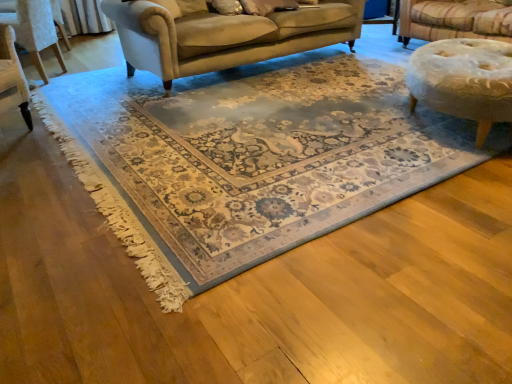
Question: Considering the relative sizes of velvet upholstered chair at upper left and beige wool rug at center in the image provided, is velvet upholstered chair at upper left smaller than beige wool rug at center?

Choices:
 (A) no
 (B) yes

Answer: (B)

Question: Can you confirm if velvet upholstered chair at upper left is thinner than beige wool rug at center?

Choices:
 (A) no
 (B) yes

Answer: (B)

Question: Does velvet upholstered chair at upper left lie in front of beige wool rug at center?

Choices:
 (A) no
 (B) yes

Answer: (A)

Question: Is velvet upholstered chair at upper left facing away from beige wool rug at center?

Choices:
 (A) yes
 (B) no

Answer: (A)

Question: Is beige wool rug at center completely or partially inside velvet upholstered chair at upper left?

Choices:
 (A) yes
 (B) no

Answer: (B)

Question: Can you confirm if velvet upholstered chair at upper left is taller than beige wool rug at center?

Choices:
 (A) no
 (B) yes

Answer: (B)

Question: Is beige wool rug at center aimed at velvet upholstered chair at upper left?

Choices:
 (A) yes
 (B) no

Answer: (B)

Question: Is the surface of beige wool rug at center in direct contact with velvet upholstered chair at upper left?

Choices:
 (A) yes
 (B) no

Answer: (B)

Question: From the image's perspective, is beige wool rug at center beneath velvet upholstered chair at upper left?

Choices:
 (A) no
 (B) yes

Answer: (B)

Question: Is beige wool rug at center looking in the opposite direction of velvet upholstered chair at upper left?

Choices:
 (A) yes
 (B) no

Answer: (B)

Question: Can you confirm if beige wool rug at center is wider than velvet upholstered chair at upper left?

Choices:
 (A) no
 (B) yes

Answer: (B)

Question: From a real-world perspective, is beige wool rug at center positioned under velvet upholstered chair at upper left based on gravity?

Choices:
 (A) no
 (B) yes

Answer: (B)

Question: Is point (24, 24) positioned closer to the camera than point (256, 259)?

Choices:
 (A) farther
 (B) closer

Answer: (A)